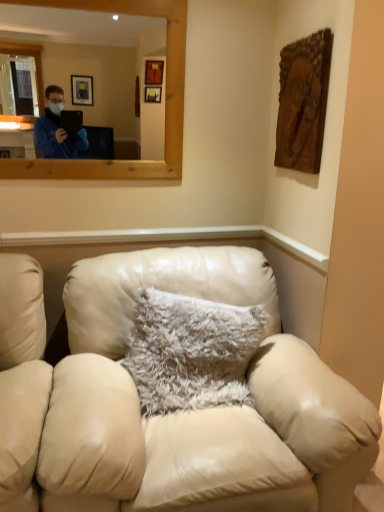
Question: Is fuzzy white pillow at center not near leather couch at center?

Choices:
 (A) no
 (B) yes

Answer: (A)

Question: Is fuzzy white pillow at center next to leather couch at center?

Choices:
 (A) yes
 (B) no

Answer: (B)

Question: Considering the relative sizes of fuzzy white pillow at center and leather couch at center in the image provided, is fuzzy white pillow at center bigger than leather couch at center?

Choices:
 (A) yes
 (B) no

Answer: (B)

Question: Can you confirm if fuzzy white pillow at center is taller than leather couch at center?

Choices:
 (A) yes
 (B) no

Answer: (B)

Question: Is fuzzy white pillow at center not within leather couch at center?

Choices:
 (A) no
 (B) yes

Answer: (A)

Question: From a real-world perspective, is fuzzy white pillow at center on leather couch at center?

Choices:
 (A) yes
 (B) no

Answer: (A)

Question: From the image's perspective, is leather couch at center below fuzzy white pillow at center?

Choices:
 (A) yes
 (B) no

Answer: (A)

Question: Is leather couch at center closer to the viewer compared to fuzzy white pillow at center?

Choices:
 (A) no
 (B) yes

Answer: (B)

Question: From a real-world perspective, is leather couch at center positioned under fuzzy white pillow at center based on gravity?

Choices:
 (A) no
 (B) yes

Answer: (B)

Question: Is leather couch at center at the left side of fuzzy white pillow at center?

Choices:
 (A) yes
 (B) no

Answer: (A)

Question: Is leather couch at center touching fuzzy white pillow at center?

Choices:
 (A) no
 (B) yes

Answer: (A)

Question: Is leather couch at center facing towards fuzzy white pillow at center?

Choices:
 (A) no
 (B) yes

Answer: (B)

Question: From a real-world perspective, is fuzzy white pillow at center located beneath wooden mirror at upper center?

Choices:
 (A) yes
 (B) no

Answer: (A)